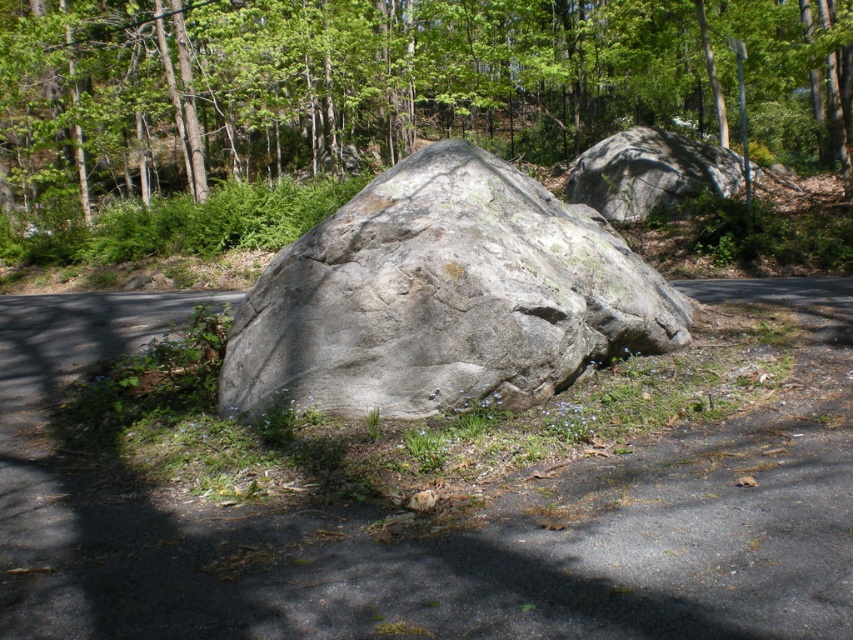
You are planning to take a photo of the green leafy tree at center and the gray rough boulder at upper right. Which object should you zoom in on to capture more details without moving the camera, considering their sizes?

The green leafy tree at center has a larger width than the gray rough boulder at upper right, so you should zoom in on the gray rough boulder at upper right to capture more details without moving the camera.

You are standing on the paved road near the two gray rough rocks. You want to move from the gray rough rock at center to the gray rough boulder at upper right. Which direction should you walk to reach it?

To reach the gray rough boulder at upper right from the gray rough rock at center, you should walk to the right since the gray rough boulder at upper right is located to the right of the gray rough rock at center.